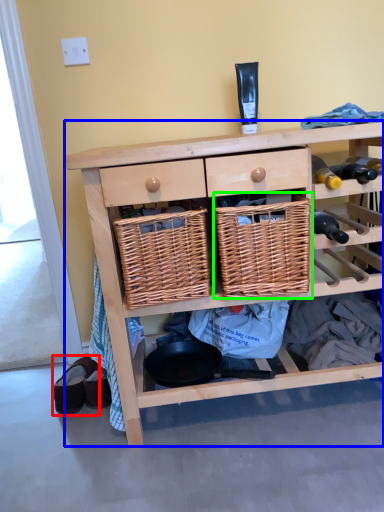
Question: Based on their relative distances, which object is farther from footwear (highlighted by a red box)? Choose from shelf (highlighted by a blue box) and basket (highlighted by a green box).

Choices:
 (A) shelf
 (B) basket

Answer: (B)